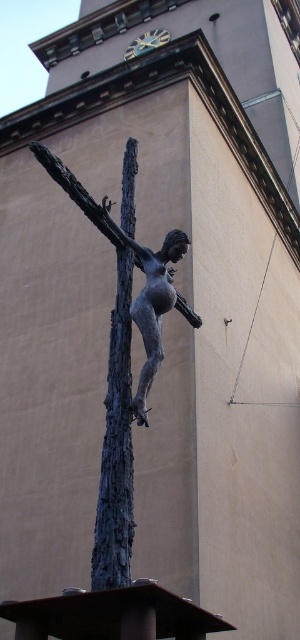
You are an art curator planning to display both the bronze statue at center and the bronze sculpture at center in a gallery. Given their sizes, which one should be placed in a larger display area to accommodate its size?

The bronze statue at center is bigger than the bronze sculpture at center, so it should be placed in a larger display area to accommodate its size.

You are an art restorer examining the sculpture. You notice two points on the sculpture marked at coordinates point (141, 378) and point (155, 368). Which point is closer to the camera?

Point (141, 378) is closer to the camera than point (155, 368).